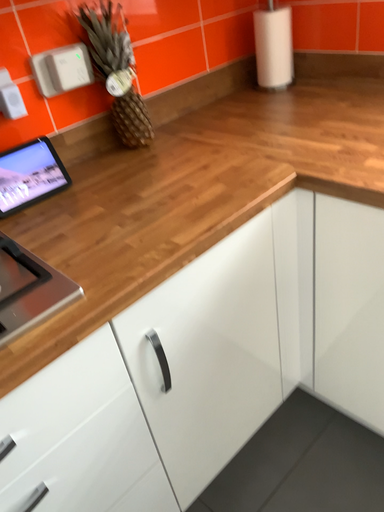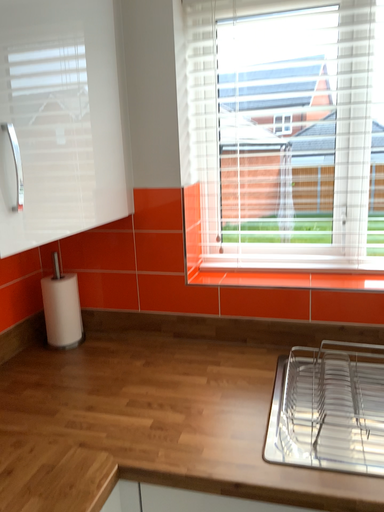
Question: Which way did the camera rotate in the video?

Choices:
 (A) rotated upward
 (B) rotated downward

Answer: (A)